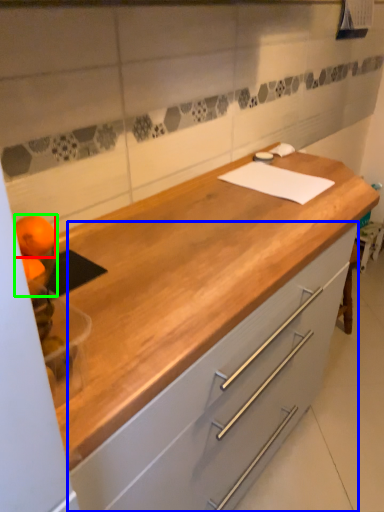
Question: Based on their relative distances, which object is nearer to orange (highlighted by a red box)? Choose from cabinetry (highlighted by a blue box) and orange (highlighted by a green box).

Choices:
 (A) cabinetry
 (B) orange

Answer: (B)